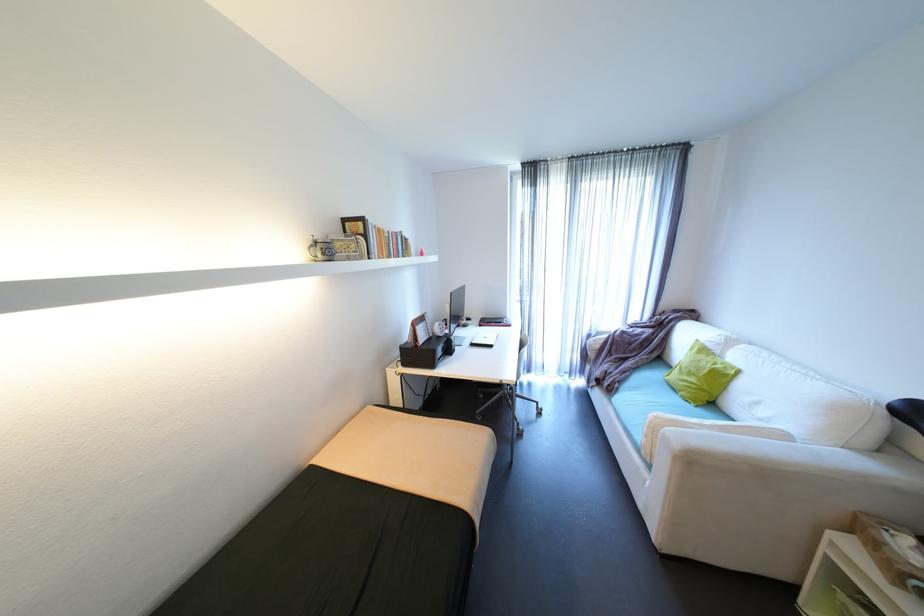
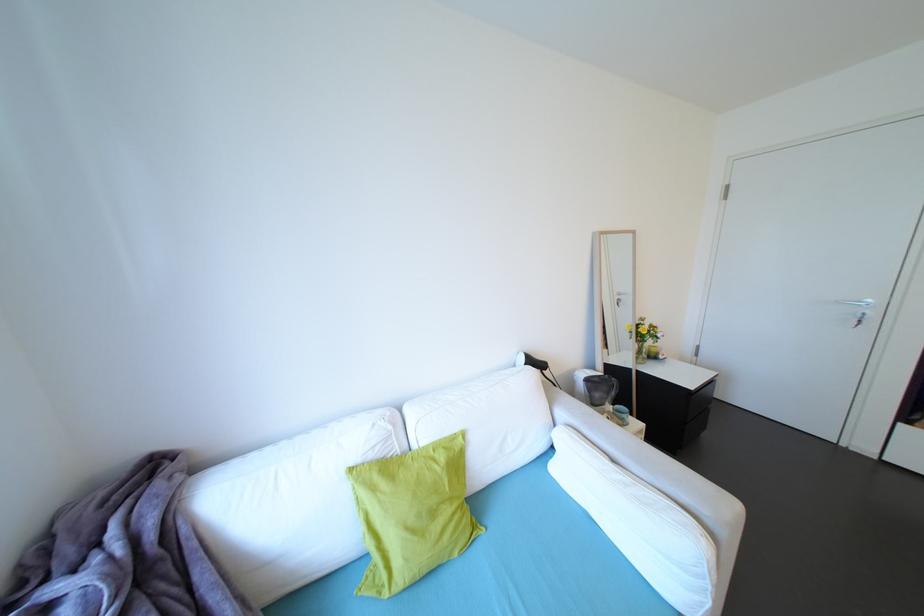
Where in the second image is the point corresponding to pixel 687 395 from the first image?

(464, 556)